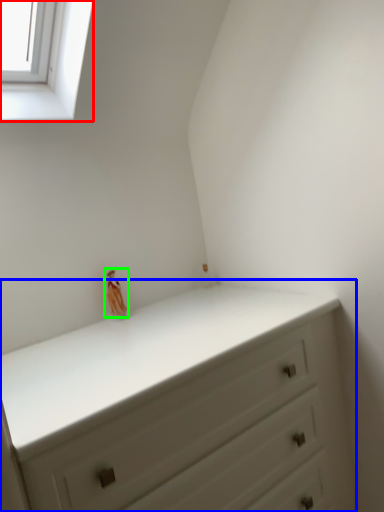
Question: Which object is positioned closest to window (highlighted by a red box)? Select from chest of drawers (highlighted by a blue box) and miniature (highlighted by a green box).

Choices:
 (A) chest of drawers
 (B) miniature

Answer: (B)